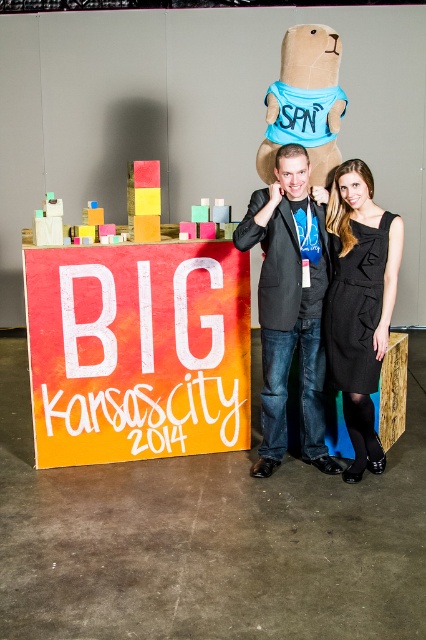
Question: Does orange painted wood sign at center appear on the left side of black textured dress at center?

Choices:
 (A) yes
 (B) no

Answer: (A)

Question: Is matte black blazer at center positioned behind black textured dress at center?

Choices:
 (A) yes
 (B) no

Answer: (B)

Question: Considering the real-world distances, which object is farthest from the orange painted wood sign at center?

Choices:
 (A) black textured dress at center
 (B) matte black blazer at center

Answer: (A)

Question: Which object is farther from the camera taking this photo?

Choices:
 (A) orange painted wood sign at center
 (B) black textured dress at center

Answer: (A)

Question: Which of the following is the closest to the observer?

Choices:
 (A) (42, 445)
 (B) (374, 448)

Answer: (B)

Question: Can you confirm if orange painted wood sign at center is thinner than matte black blazer at center?

Choices:
 (A) yes
 (B) no

Answer: (B)